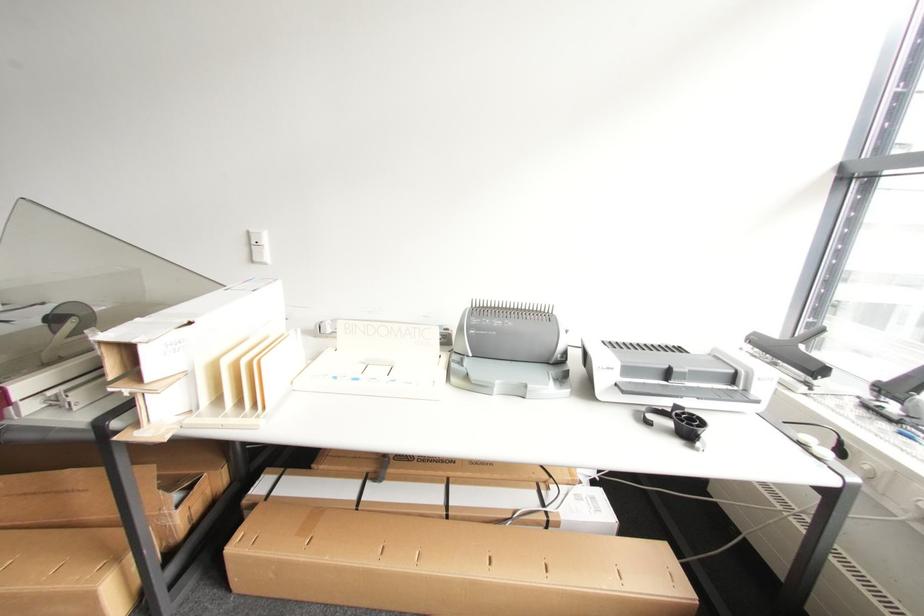
Identify the location of binding machine lid. (676, 376).